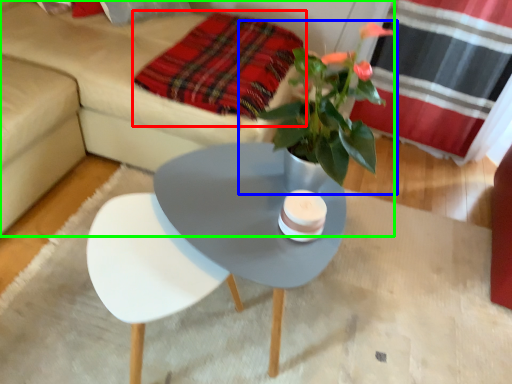
Question: Which is farther away from blanket (highlighted by a red box)? houseplant (highlighted by a blue box) or studio couch (highlighted by a green box)?

Choices:
 (A) houseplant
 (B) studio couch

Answer: (A)